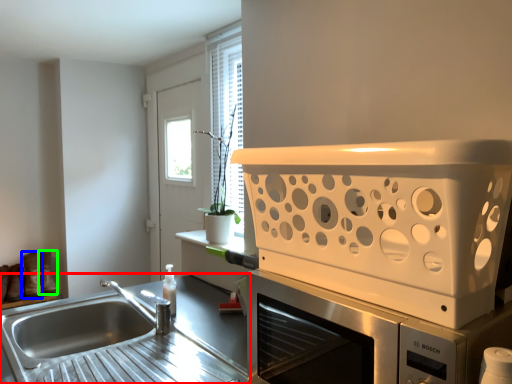
Question: Based on their relative distances, which object is farther from countertop (highlighted by a red box)? Choose from shoe (highlighted by a blue box) and boot (highlighted by a green box).

Choices:
 (A) shoe
 (B) boot

Answer: (B)